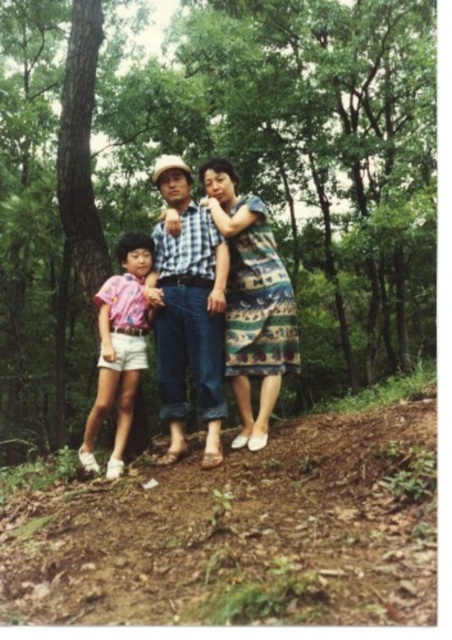
You are a photographer trying to capture the family in the woods. You notice the checkered fabric shirt at center. Where exactly is this shirt positioned in relation to the other family members?

The checkered fabric shirt at center is located at point 0.486 on the x and 0.416 on the y coordinates, which places it centrally among the family members.

You are a fashion designer observing the family in the wooded area. You notice the matte blue jeans at center and the checkered fabric shirt at center. Which clothing item appears bigger in size?

The matte blue jeans at center is larger in size than the checkered fabric shirt at center.